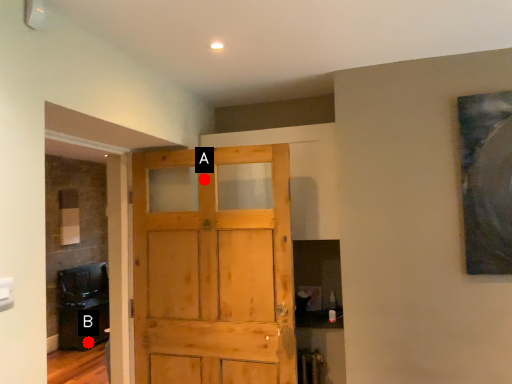
Question: Two points are circled on the image, labeled by A and B beside each circle. Which point is further to the camera?

Choices:
 (A) A is further
 (B) B is further

Answer: (B)